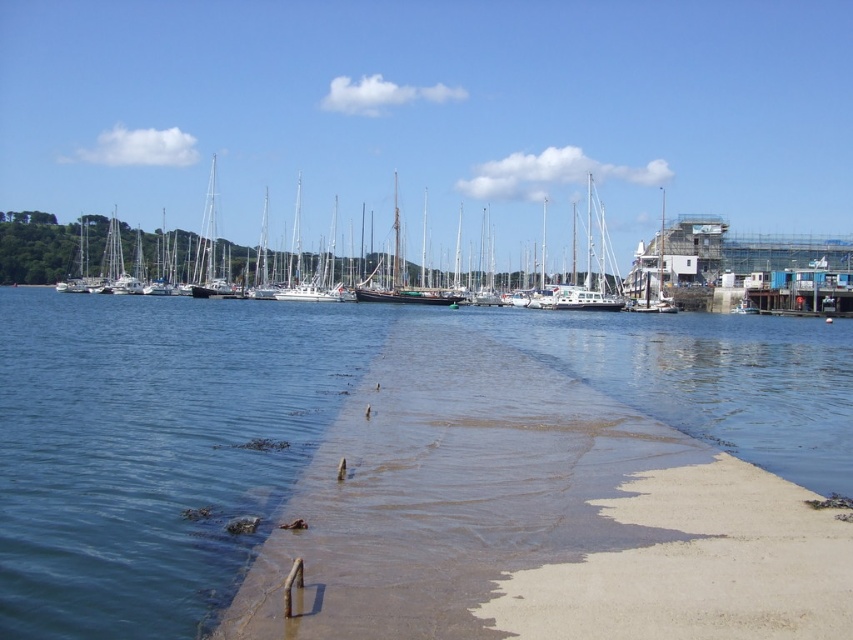
Does point (732, 589) come behind point (85, 268)?

No, (732, 589) is in front of (85, 268).

Where is `sandy concrete at center`? The height and width of the screenshot is (640, 853). sandy concrete at center is located at coordinates (567, 490).

You are a GUI agent. You are given a task and a screenshot of the screen. Output one action in this format:
    pyautogui.click(x=<x>, y=<y>)
    Task: Click on the sandy concrete at center
    Image resolution: width=853 pixels, height=640 pixels.
    Given the screenshot: What is the action you would take?
    567,490

Does sandy concrete at center have a larger size compared to clear water at lower left?

Incorrect, sandy concrete at center is not larger than clear water at lower left.

Is sandy concrete at center positioned in front of clear water at lower left?

Yes, it is.

Who is more forward, (792, 628) or (265, 378)?

Point (792, 628) is more forward.

Where is `sandy concrete at center`? The height and width of the screenshot is (640, 853). sandy concrete at center is located at coordinates tap(567, 490).

Which is above, clear water at lower left or wooden sailboat at center?

wooden sailboat at center is above.

Is clear water at lower left thinner than wooden sailboat at center?

Correct, clear water at lower left's width is less than wooden sailboat at center's.

Does point (26, 460) come behind point (140, 291)?

No, it is not.

Locate an element on the screen. The image size is (853, 640). clear water at lower left is located at coordinates (x=154, y=449).